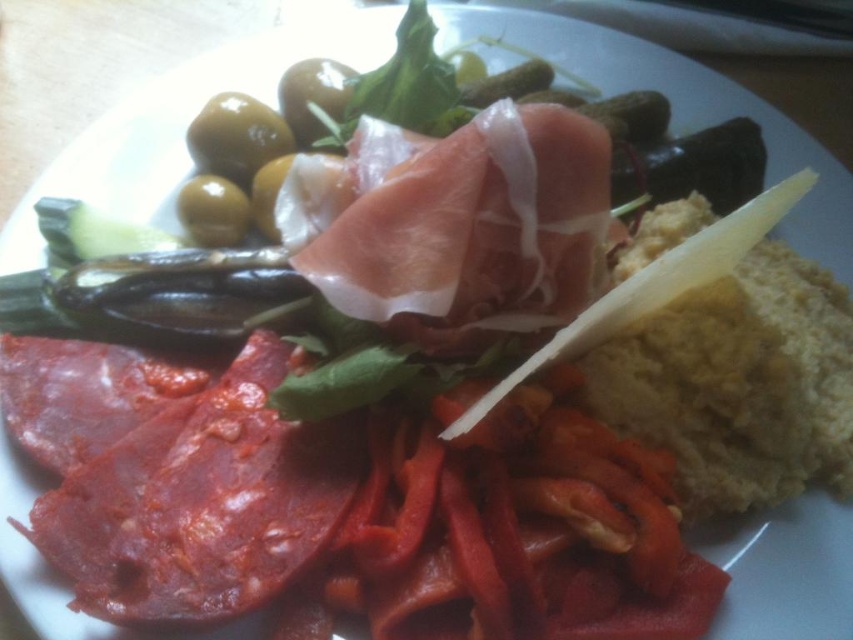
Question: Is red glossy salami at lower left behind pinkish-white cured meat at center?

Choices:
 (A) yes
 (B) no

Answer: (B)

Question: Where is red glossy salami at lower left located in relation to pinkish-white cured meat at center in the image?

Choices:
 (A) right
 (B) left

Answer: (B)

Question: Among these points, which one is nearest to the camera?

Choices:
 (A) (305, 513)
 (B) (389, 232)

Answer: (A)

Question: Can you confirm if red glossy salami at lower left is positioned to the right of pinkish-white cured meat at center?

Choices:
 (A) no
 (B) yes

Answer: (A)